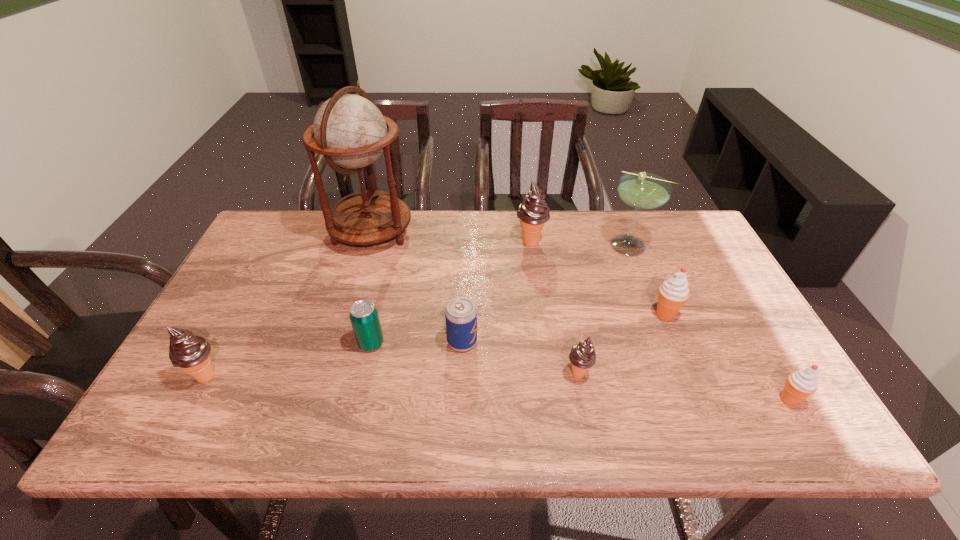
Locate an element on the screen. the right red icecream is located at coordinates click(x=801, y=384).

This screenshot has width=960, height=540. I want to click on the rightmost object, so click(x=801, y=384).

Image resolution: width=960 pixels, height=540 pixels. Identify the location of the smallest chocolate icecream. (582, 356).

Image resolution: width=960 pixels, height=540 pixels. In order to click on blank space located on the surface of the globe in this screenshot , I will do `click(508, 232)`.

Where is `vacant position located 0.090m on the right of the green martini`? The height and width of the screenshot is (540, 960). vacant position located 0.090m on the right of the green martini is located at coordinates (688, 246).

Identify the location of free space located 0.120m on the right of the tallest icecream. The width and height of the screenshot is (960, 540). (585, 242).

This screenshot has height=540, width=960. In order to click on vacant space located on the back of the second smallest chocolate icecream in this screenshot , I will do `click(229, 333)`.

The width and height of the screenshot is (960, 540). I want to click on free space located on the front of the sixth nearest object, so click(712, 430).

I want to click on blank space located on the right of the right beer can, so click(625, 342).

Where is `vacant space situated 0.050m on the front of the left beer can`? vacant space situated 0.050m on the front of the left beer can is located at coordinates (365, 371).